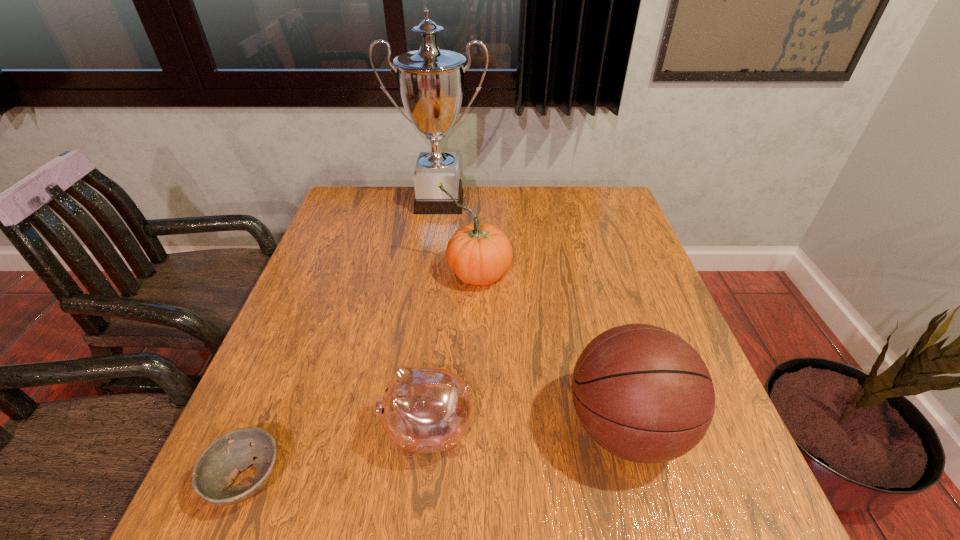
Identify the location of vacant space in between the bowl and the second shortest object. click(x=338, y=455).

This screenshot has width=960, height=540. In order to click on free space between the piggy bank and the basketball in this screenshot , I will do `click(527, 429)`.

Where is `blank region between the shortest object and the rightmost object`? The height and width of the screenshot is (540, 960). blank region between the shortest object and the rightmost object is located at coordinates (437, 453).

Image resolution: width=960 pixels, height=540 pixels. Identify the location of empty location between the shortest object and the second farthest object. (362, 376).

The height and width of the screenshot is (540, 960). Find the location of `vacant region between the rightmost object and the farthest object`. vacant region between the rightmost object and the farthest object is located at coordinates (533, 314).

Where is `free space between the tallest object and the basketball`? Image resolution: width=960 pixels, height=540 pixels. free space between the tallest object and the basketball is located at coordinates (533, 314).

Where is `object that is the third closest one to the leftmost object`? The image size is (960, 540). object that is the third closest one to the leftmost object is located at coordinates (644, 394).

The image size is (960, 540). I want to click on object that is the third closest to the fourth tallest object, so click(x=479, y=253).

The height and width of the screenshot is (540, 960). In order to click on free space that satisfies the following two spatial constraints: 1. on the back side of the pumpkin; 2. on the right side of the leftmost object in this screenshot , I will do `click(329, 273)`.

What are the coordinates of `free location that satisfies the following two spatial constraints: 1. on the back side of the pumpkin; 2. on the left side of the shortest object` in the screenshot? It's located at [329, 273].